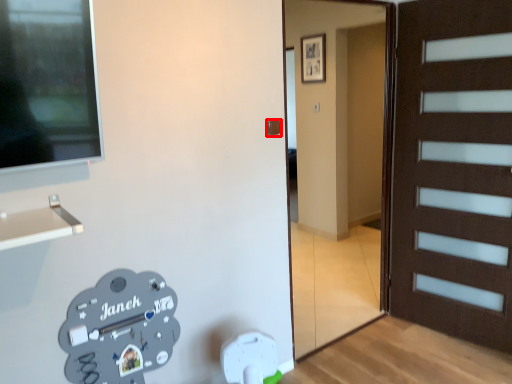
Question: Considering the relative positions of door handle (annotated by the red box) and garage door in the image provided, where is door handle (annotated by the red box) located with respect to the staircase?

Choices:
 (A) left
 (B) right

Answer: (A)